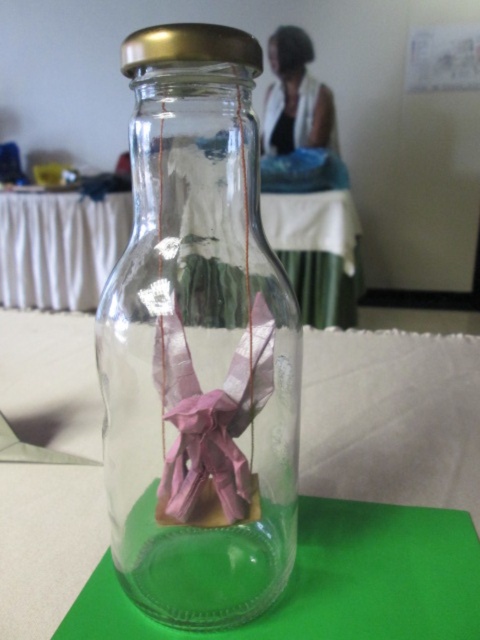
From the picture: You are trying to see the pink paper ribbon at center through the transparent glass table at center. Can you see it clearly?

The pink paper ribbon at center is behind the transparent glass table at center, so it can be seen through the table.

You are trying to place a small decorative item on the transparent glass table at center. However, you notice the pink paper ribbon at center is already there. Is the table still usable for placing your item without moving the ribbon?

The transparent glass table at center is much taller than the pink paper ribbon at center, so there is enough space above the ribbon to place your item on the table without needing to move it.